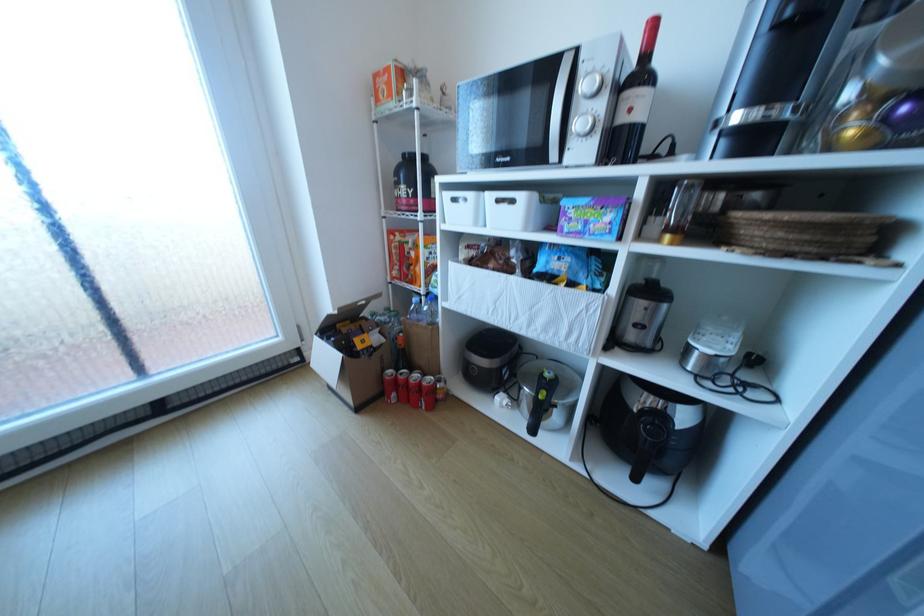
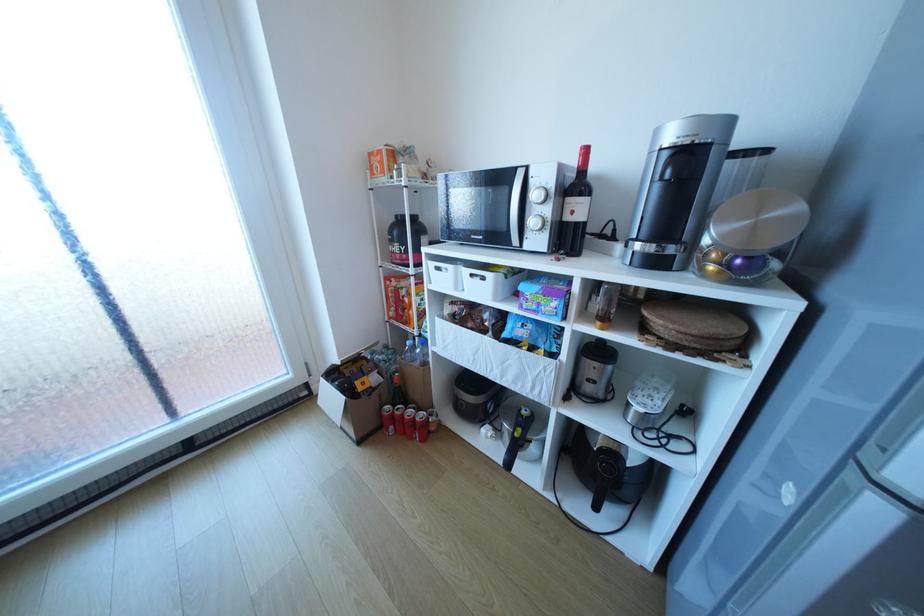
The point at (464, 201) is marked in the first image. Where is the corresponding point in the second image?

(446, 268)